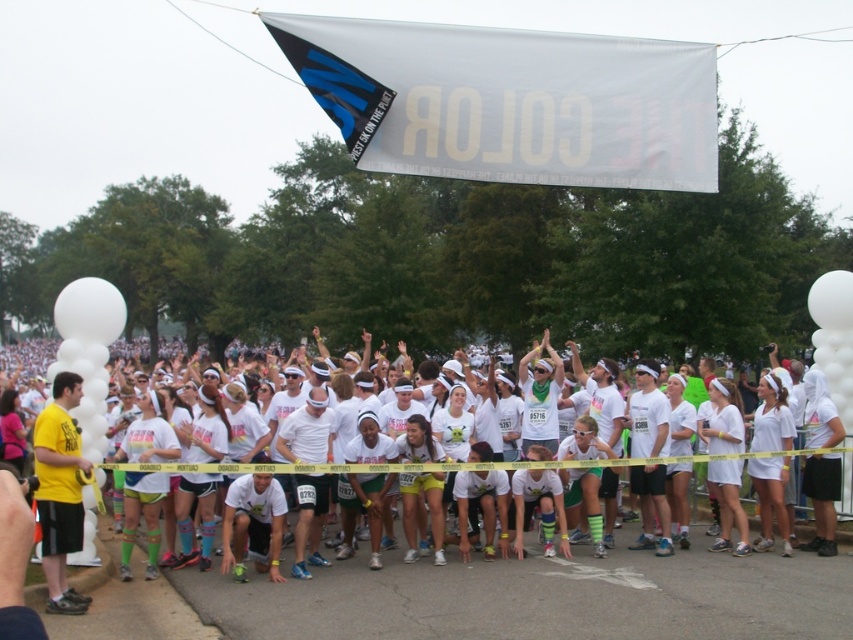
Question: Which point is closer to the camera taking this photo?

Choices:
 (A) (741, 440)
 (B) (51, 419)
 (C) (612, 177)

Answer: (B)

Question: Is white fabric banner at upper center bigger than white matte t-shirt at center?

Choices:
 (A) yes
 (B) no

Answer: (B)

Question: Does white fabric banner at upper center come behind yellow matte shirt at left?

Choices:
 (A) yes
 (B) no

Answer: (A)

Question: Which object is closer to the camera taking this photo?

Choices:
 (A) white matte t-shirt at center
 (B) yellow matte shirt at left

Answer: (A)

Question: Is white matte t-shirt at center wider than white matte shorts at lower right?

Choices:
 (A) yes
 (B) no

Answer: (A)

Question: Which of these objects is positioned closest to the yellow matte shirt at left?

Choices:
 (A) white fabric banner at upper center
 (B) white matte shorts at lower right

Answer: (B)